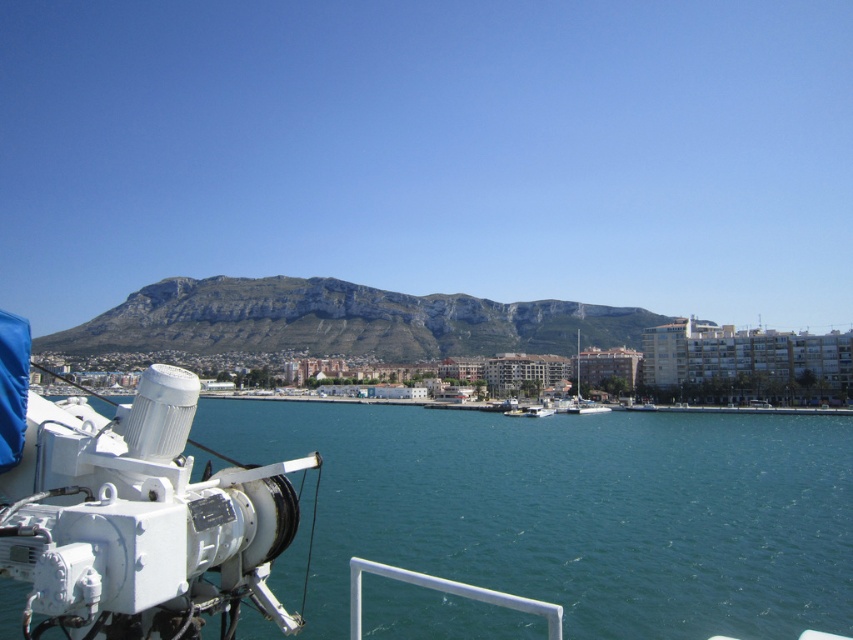
You are a sailor trying to navigate between the clear blue water at lower left and the rugged stone mountain at center. Since the water is narrower, which path should you choose to ensure your boat has enough space?

The rugged stone mountain at center is wider than the clear blue water at lower left, so you should choose the path near the rugged stone mountain at center to ensure there is enough space for your boat.

You are standing on the deck of a ship and want to know how far the point at coordinates (258, 307) is from you. Can you determine the distance?

The point at coordinates (258, 307) is 1013.48 feet away from you.

You are an observer on the ship deck. You see the rugged stone mountain at center and the white matte sailboat at center. Which object is wider?

The rugged stone mountain at center is wider than the white matte sailboat at center.